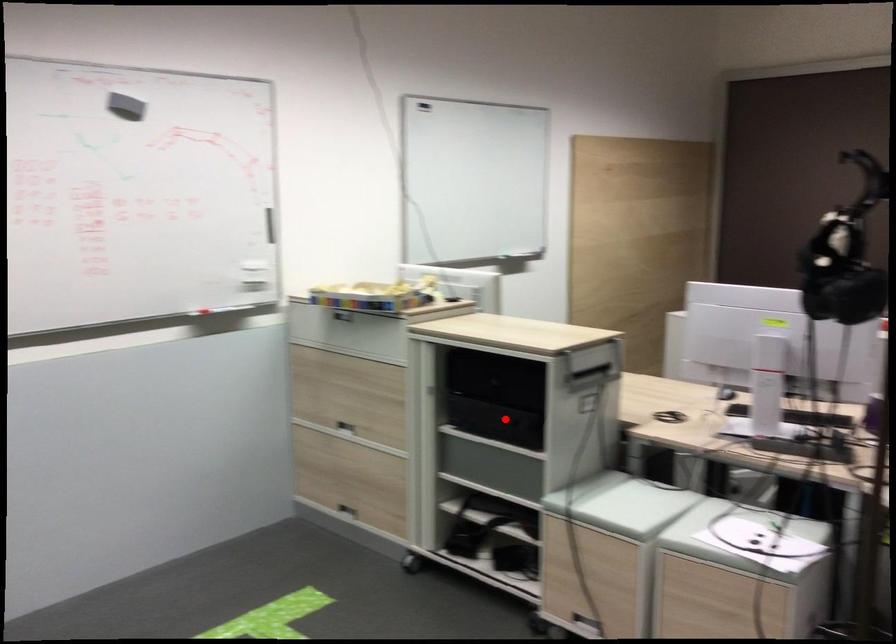
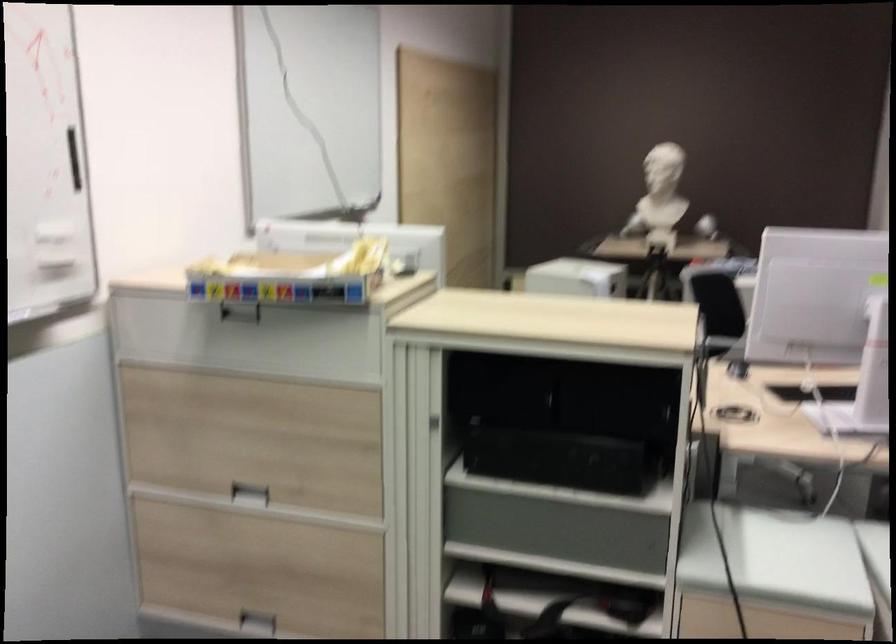
Question: I am providing you with two images of the same scene from different viewpoints. Given a red point in image1, look at the same physical point in image2. Is it:

Choices:
 (A) Closer to the viewpoint
 (B) Farther from the viewpoint

Answer: (A)